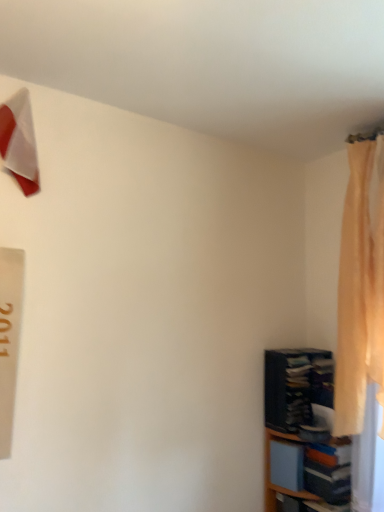
Question: In the image, is silky beige curtain at right on the left side or the right side of wooden bookshelf at lower right?

Choices:
 (A) right
 (B) left

Answer: (A)

Question: Considering the positions of silky beige curtain at right and wooden bookshelf at lower right in the image, is silky beige curtain at right taller or shorter than wooden bookshelf at lower right?

Choices:
 (A) short
 (B) tall

Answer: (B)

Question: Estimate the real-world distances between objects in this image. Which object is closer to the dark blue fabric bookshelf at lower right?

Choices:
 (A) wooden bookshelf at lower right
 (B) silky beige curtain at right
 (C) white glossy triangle at upper left

Answer: (A)

Question: Which is farther from the dark blue fabric bookshelf at lower right?

Choices:
 (A) white glossy triangle at upper left
 (B) silky beige curtain at right
 (C) wooden bookshelf at lower right

Answer: (A)